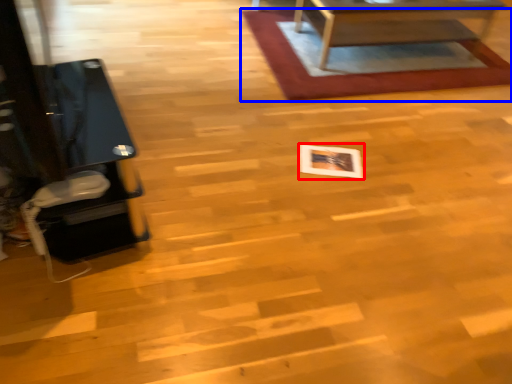
Question: Which of the following is the closest to the observer, square (highlighted by a red box) or mat (highlighted by a blue box)?

Choices:
 (A) square
 (B) mat

Answer: (A)